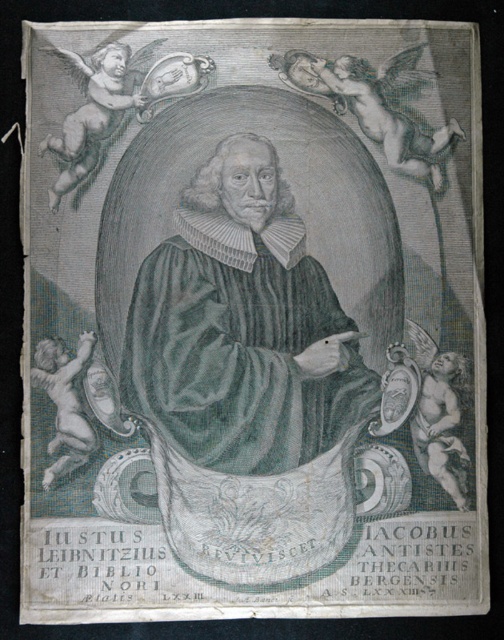
Question: Does smooth skin cherub at upper right have a greater width compared to smooth cherub at lower right?

Choices:
 (A) no
 (B) yes

Answer: (B)

Question: Is smooth skin cherub at upper right to the right of smooth white cherub at upper left from the viewer's perspective?

Choices:
 (A) no
 (B) yes

Answer: (B)

Question: Estimate the real-world distances between objects in this image. Which object is closer to the smooth cherub at lower right?

Choices:
 (A) green striped robe at center
 (B) smooth cherub at lower left
 (C) smooth white cherub at upper left

Answer: (A)

Question: Estimate the real-world distances between objects in this image. Which object is farther from the smooth cherub at lower right?

Choices:
 (A) green striped robe at center
 (B) smooth skin cherub at upper right

Answer: (B)

Question: Is green striped robe at center below smooth cherub at lower left?

Choices:
 (A) no
 (B) yes

Answer: (A)

Question: Among these points, which one is nearest to the camera?

Choices:
 (A) (453, 401)
 (B) (448, 131)
 (C) (353, 369)

Answer: (C)